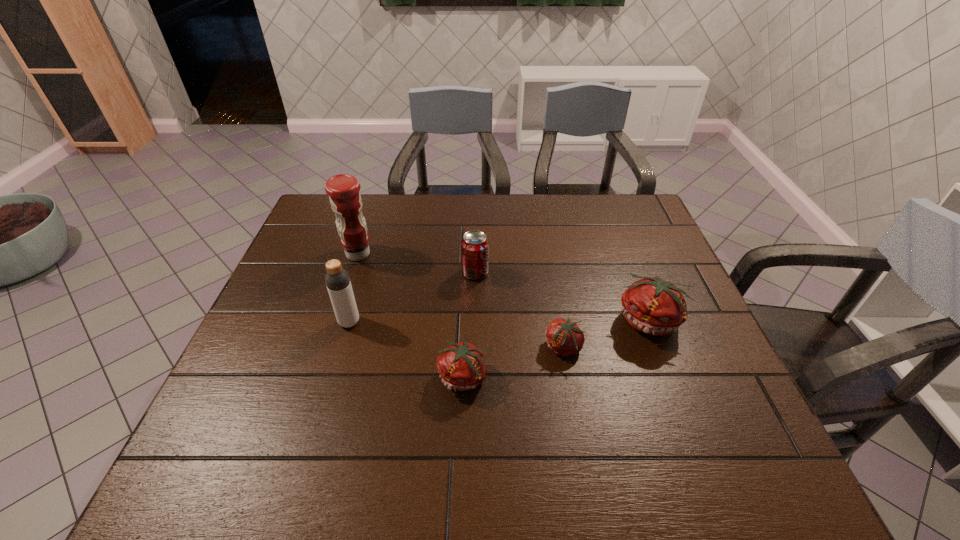
At what (x,y) coordinates should I click in order to perform the action: click on free space located 0.050m on the left of the shortest tomato. Please return your answer as a coordinate pair (x, y). Image resolution: width=960 pixels, height=540 pixels. Looking at the image, I should click on (523, 348).

You are a GUI agent. You are given a task and a screenshot of the screen. Output one action in this format:
    pyautogui.click(x=<x>, y=<y>)
    Task: Click on the free region located on the left of the rightmost object
    The image size is (960, 540).
    Given the screenshot: What is the action you would take?
    pyautogui.click(x=468, y=321)

You are a GUI agent. You are given a task and a screenshot of the screen. Output one action in this format:
    pyautogui.click(x=<x>, y=<y>)
    Task: Click on the vacant space located on the right of the fifth shortest object
    
    Given the screenshot: What is the action you would take?
    pyautogui.click(x=427, y=322)

You are a GUI agent. You are given a task and a screenshot of the screen. Output one action in this format:
    pyautogui.click(x=<x>, y=<y>)
    Task: Click on the free space located on the left of the soda can
    The height and width of the screenshot is (540, 960).
    Given the screenshot: What is the action you would take?
    pyautogui.click(x=437, y=273)

At what (x,y) coordinates should I click in order to perform the action: click on vacant area situated 0.270m on the front of the tallest object. Please return your answer as a coordinate pair (x, y). This screenshot has height=540, width=960. Looking at the image, I should click on (330, 339).

Locate an element on the screen. This screenshot has width=960, height=540. object at the near edge is located at coordinates click(462, 366).

You are a GUI agent. You are given a task and a screenshot of the screen. Output one action in this format:
    pyautogui.click(x=<x>, y=<y>)
    Task: Click on the object that is at the left edge
    The width and height of the screenshot is (960, 540).
    Given the screenshot: What is the action you would take?
    pyautogui.click(x=343, y=189)

This screenshot has width=960, height=540. Identify the location of object at the right edge. (652, 305).

In order to click on vacant space at the far edge of the desktop in this screenshot , I will do `click(577, 216)`.

The width and height of the screenshot is (960, 540). Identify the location of vacant space at the near edge. pos(645,414).